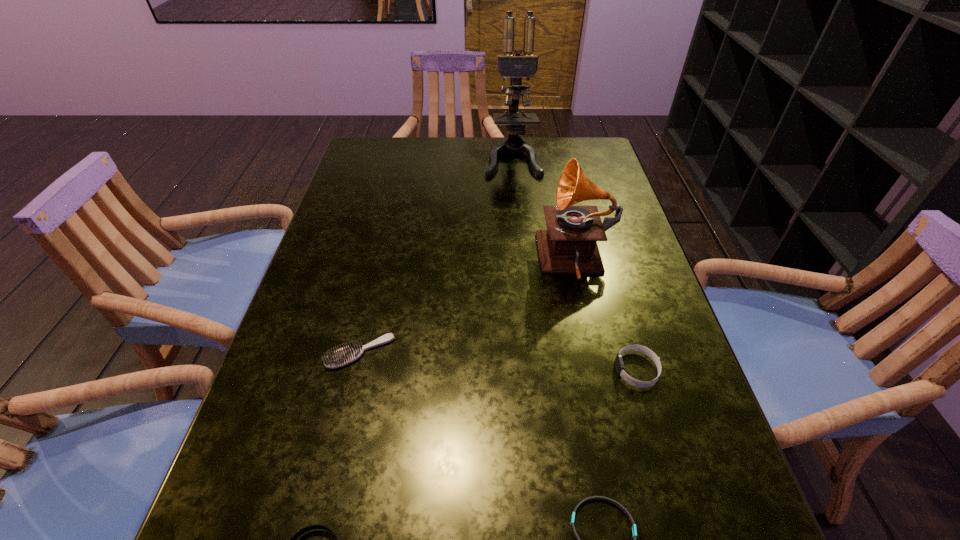
In order to click on free space located on the horn of the phonograph record in this screenshot , I will do `click(510, 261)`.

Find the location of a particular element. The height and width of the screenshot is (540, 960). vacant space located on the outer surface of the tallest wristband is located at coordinates (515, 370).

This screenshot has width=960, height=540. In order to click on vacant space located 0.200m on the outer surface of the tallest wristband in this screenshot , I will do `click(509, 370)`.

Locate an element on the screen. The width and height of the screenshot is (960, 540). free region located on the outer surface of the tallest wristband is located at coordinates (488, 370).

You are a GUI agent. You are given a task and a screenshot of the screen. Output one action in this format:
    pyautogui.click(x=<x>, y=<y>)
    Task: Click on the free region located 0.110m on the back of the scrubbing brush
    
    Given the screenshot: What is the action you would take?
    pyautogui.click(x=373, y=295)

I want to click on object at the far edge, so click(x=516, y=66).

Locate an element on the screen. The width and height of the screenshot is (960, 540). object present at the left edge is located at coordinates (343, 356).

The image size is (960, 540). In order to click on phonograph record positioned at the right edge in this screenshot , I will do `click(569, 245)`.

You are a GUI agent. You are given a task and a screenshot of the screen. Output one action in this format:
    pyautogui.click(x=<x>, y=<y>)
    Task: Click on the wristband present at the right edge
    The image size is (960, 540).
    Given the screenshot: What is the action you would take?
    pyautogui.click(x=619, y=364)

At what (x,y) coordinates should I click in order to perform the action: click on vacant point at the far edge. Please return your answer as a coordinate pair (x, y). Looking at the image, I should click on coord(436,142).